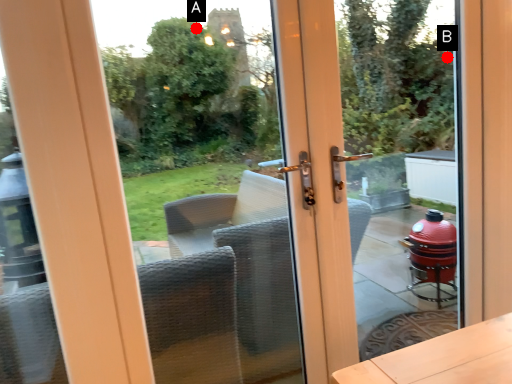
Question: Two points are circled on the image, labeled by A and B beside each circle. Among these points, which one is nearest to the camera?

Choices:
 (A) A is closer
 (B) B is closer

Answer: (B)